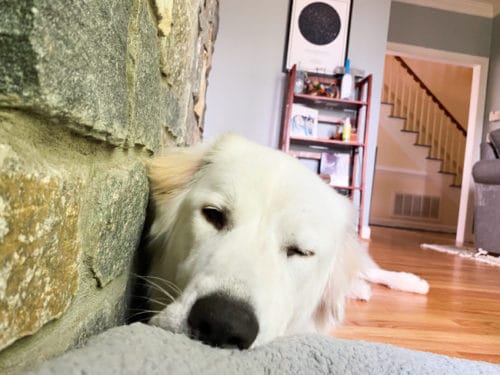
What are the coordinates of `door frame` in the screenshot? It's located at (479, 94), (461, 57).